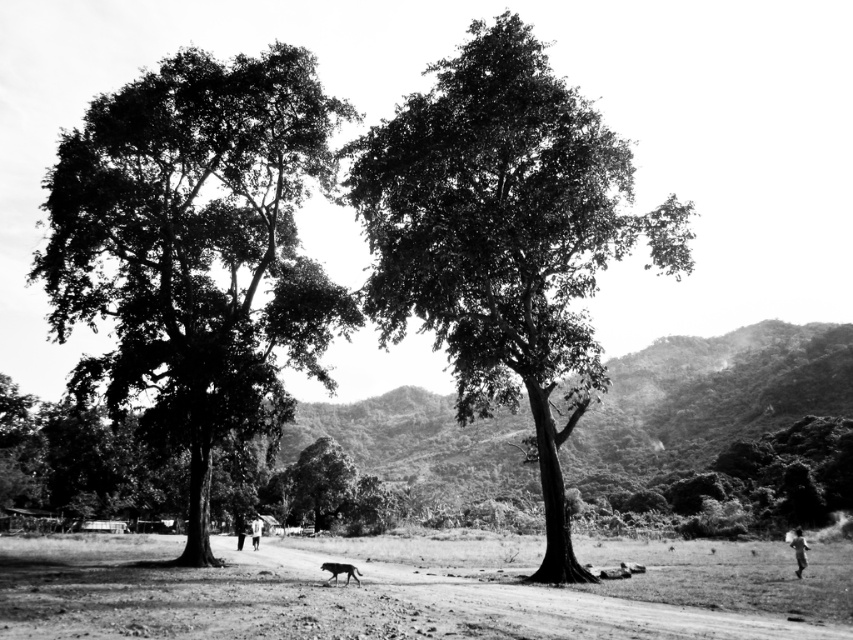
Question: Estimate the real-world distances between objects in this image. Which object is closer to the dark green leafy tree at left?

Choices:
 (A) white cotton shirt at center
 (B) gray fur dog at center
 (C) smooth bark tree at center
 (D) dirt field at lower center

Answer: (C)

Question: Which point appears farthest from the camera in this image?

Choices:
 (A) (199, 237)
 (B) (799, 554)
 (C) (677, 632)
 (D) (490, 376)

Answer: (D)

Question: Does smooth bark tree at center have a lesser width compared to gray fur dog at center?

Choices:
 (A) no
 (B) yes

Answer: (A)

Question: Does dark green leafy tree at left appear under white cotton shirt at center?

Choices:
 (A) no
 (B) yes

Answer: (A)

Question: Among these objects, which one is farthest from the camera?

Choices:
 (A) gray fur dog at center
 (B) dark skin human at lower right

Answer: (B)

Question: Is dark green leafy tree at left below white cotton shirt at center?

Choices:
 (A) yes
 (B) no

Answer: (B)